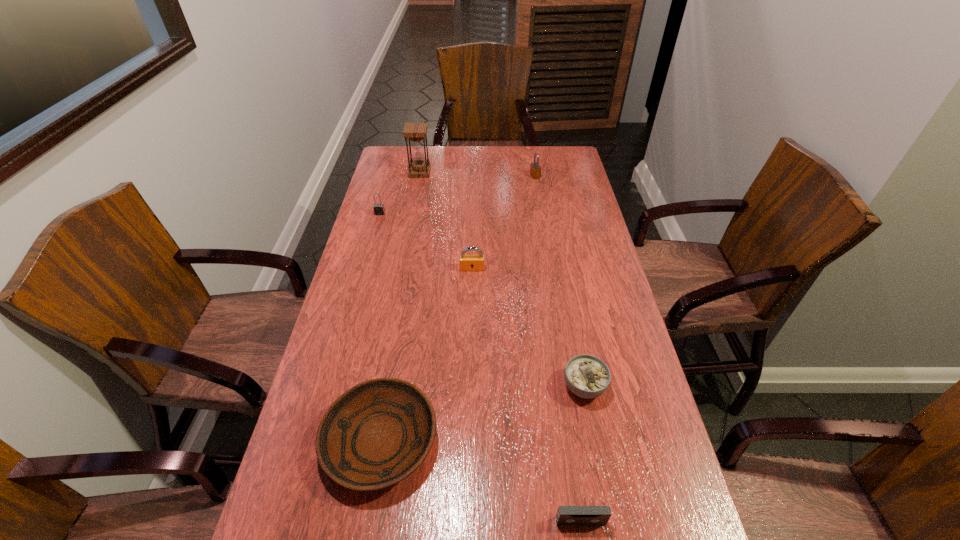
The width and height of the screenshot is (960, 540). Find the location of `free point located on the left of the farthest padlock`. free point located on the left of the farthest padlock is located at coordinates click(473, 176).

This screenshot has width=960, height=540. Identify the location of free space located to unlock the fourth farthest object from the front. (470, 339).

You are a GUI agent. You are given a task and a screenshot of the screen. Output one action in this format:
    pyautogui.click(x=<x>, y=<y>)
    Task: Click on the vacant space situated on the shackle of the leftmost padlock
    This screenshot has width=960, height=540.
    Given the screenshot: What is the action you would take?
    pyautogui.click(x=362, y=278)

Identify the location of vacant space located 0.310m on the left of the soup bowl. (442, 387).

Locate an element on the screen. The height and width of the screenshot is (540, 960). vacant region located 0.230m on the right of the plate is located at coordinates (537, 441).

Locate an element on the screen. hourglass present at the far edge is located at coordinates [x=416, y=132].

In order to click on padlock positioned at the far edge in this screenshot , I will do `click(535, 170)`.

Find the location of `hourglass that is positioned at the left edge`. hourglass that is positioned at the left edge is located at coordinates (416, 132).

The height and width of the screenshot is (540, 960). Find the location of `padlock located in the left edge section of the desktop`. padlock located in the left edge section of the desktop is located at coordinates (379, 209).

The width and height of the screenshot is (960, 540). I want to click on plate positioned at the left edge, so click(377, 433).